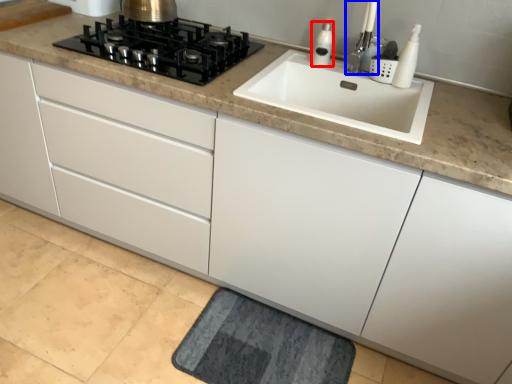
Question: Among these objects, which one is nearest to the camera, soap dispenser (highlighted by a red box) or faucet (highlighted by a blue box)?

Choices:
 (A) soap dispenser
 (B) faucet

Answer: (B)